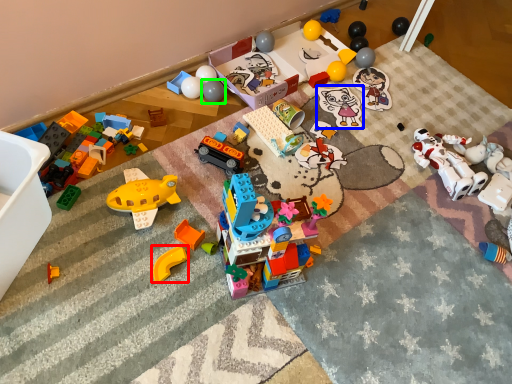
Question: Which object is positioned closest to toy (highlighted by a red box)? Select from toy (highlighted by a blue box) and toy (highlighted by a green box).

Choices:
 (A) toy
 (B) toy

Answer: (B)